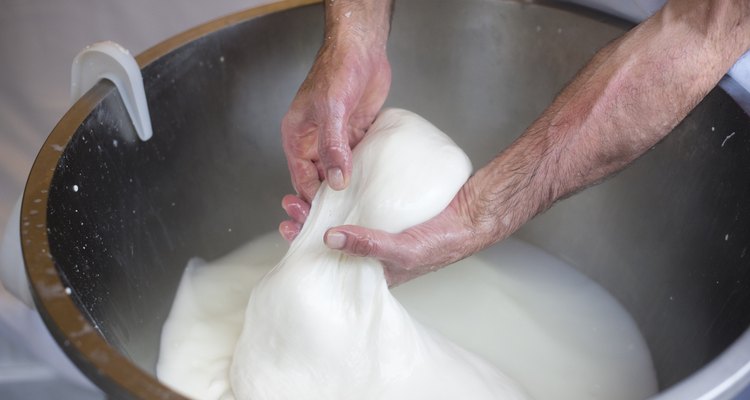
Identify the location of plastic hook. (118, 82).